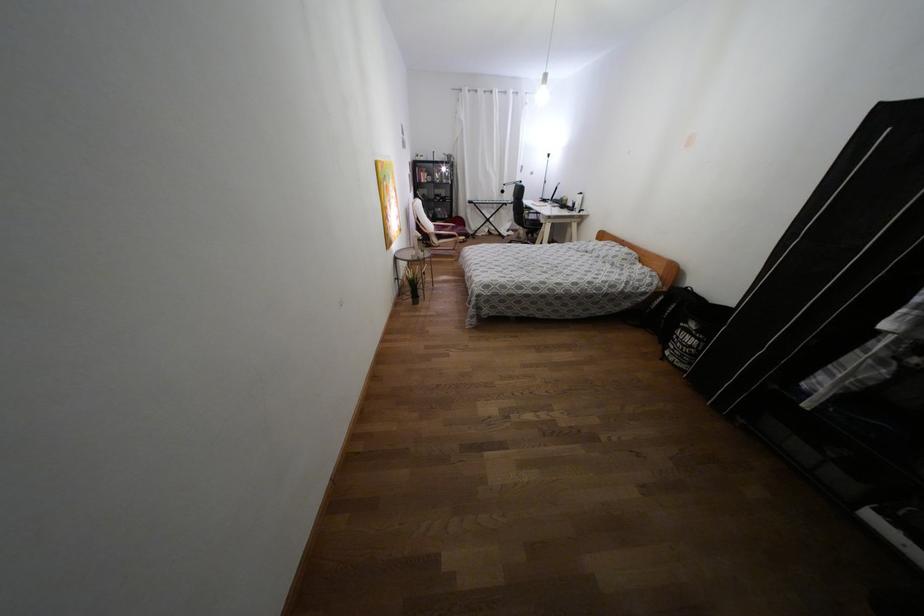
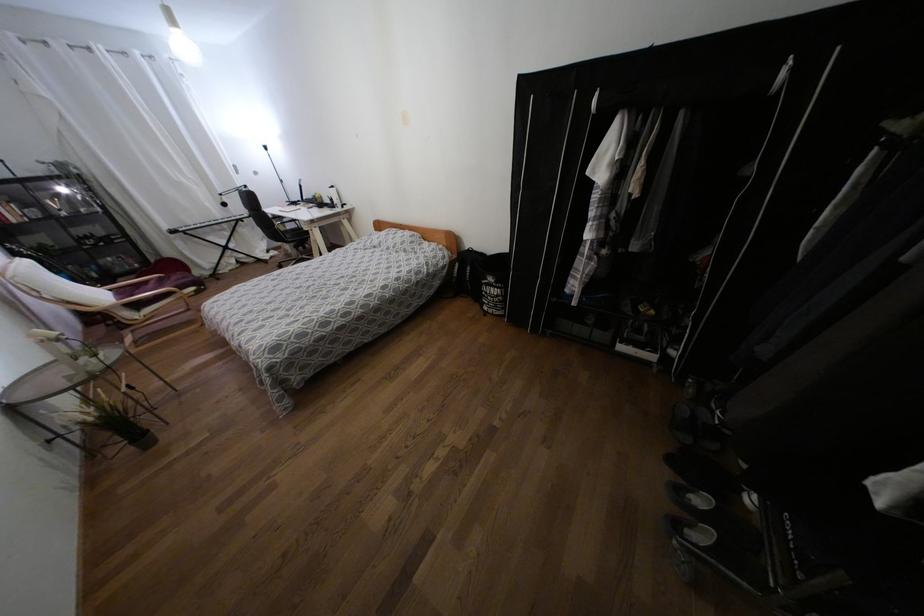
Question: Based on the continuous images, in which direction is the camera rotating? Reply with the corresponding letter.

Choices:
 (A) Left
 (B) Right
 (C) Up
 (D) Down

Answer: (B)